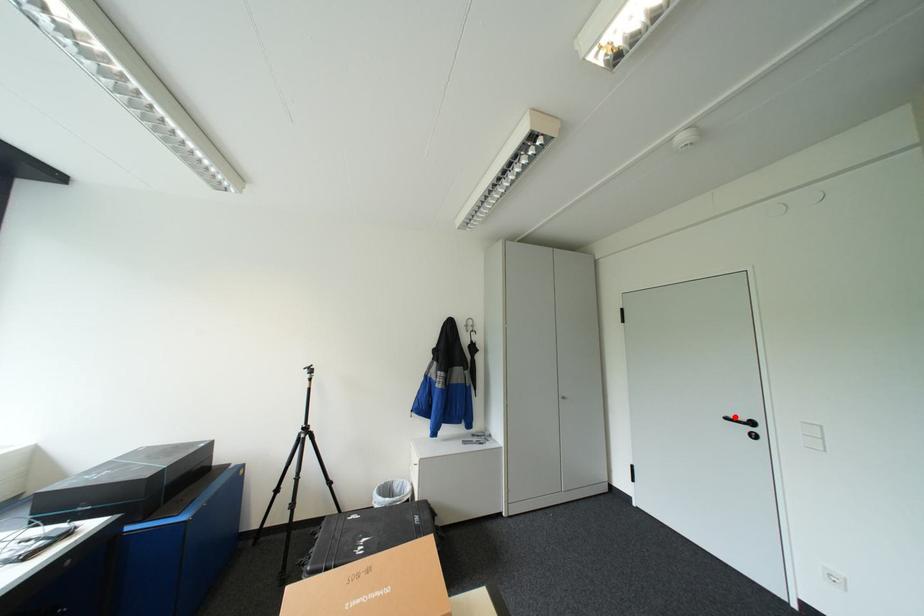
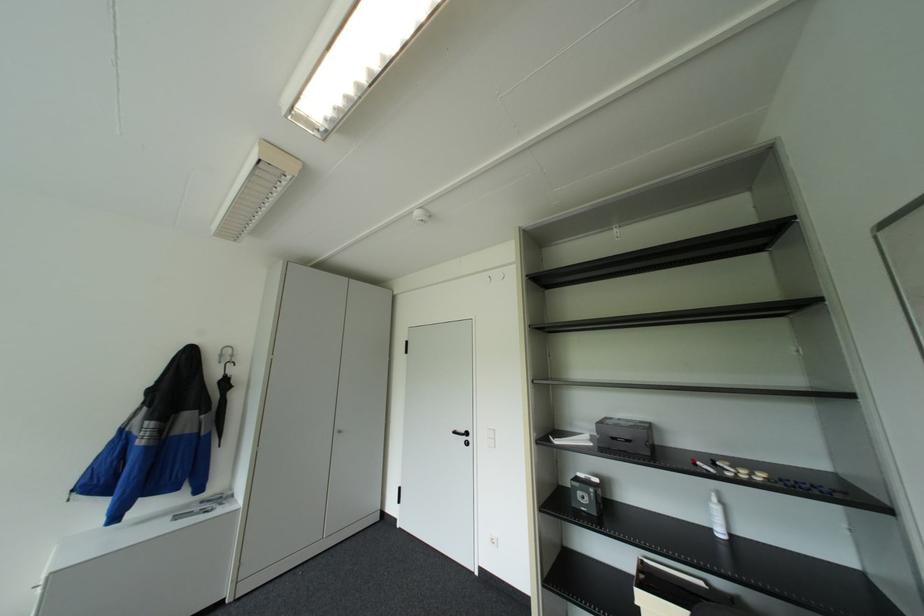
Where in the second image is the point corresponding to the highlighted location from the first image?

(463, 431)